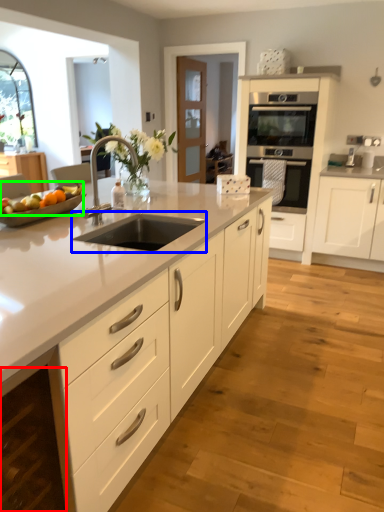
Question: Which object is the closest to the cabinetry (highlighted by a red box)? Choose among these: open (highlighted by a blue box) or fruit (highlighted by a green box).

Choices:
 (A) open
 (B) fruit

Answer: (A)